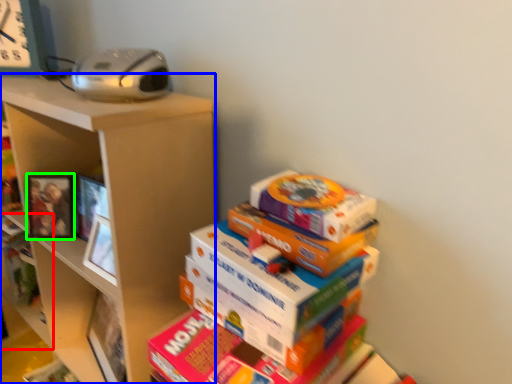
Question: Which object is positioned farthest from shelf (highlighted by a red box)? Select from shelf (highlighted by a blue box) and picture frame (highlighted by a green box).

Choices:
 (A) shelf
 (B) picture frame

Answer: (A)